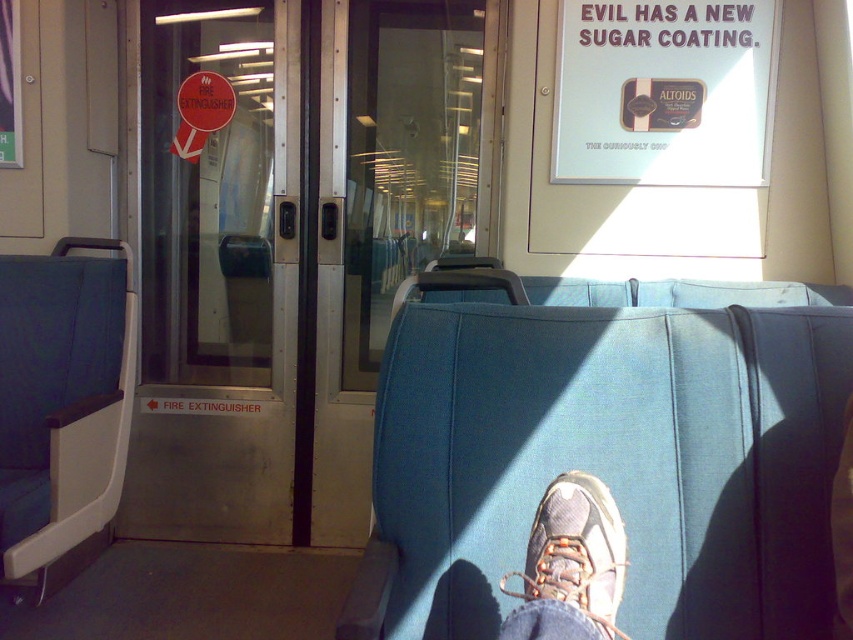
Consider the image. You are a passenger on the train and want to put your feet up on the blue fabric seat at center. However, there is a camouflage fabric sneaker at lower center in the way. Can you move the sneaker to access the seat?

The camouflage fabric sneaker at lower center is behind the blue fabric seat at center, so you cannot directly access it to move it. You would need to ask the owner of the sneaker to move it.

You are standing in the train car and want to sit down. The blue fabric seat at center and the camouflage fabric sneaker at lower center are both in your view. Which object is located to the right side of the other?

The blue fabric seat at center is to the right of camouflage fabric sneaker at lower center.

You are a passenger in the train car and need to know if you can place your backpack between the blue fabric seat at center and the camouflage fabric sneaker at lower center. Can you fit your backpack there?

The blue fabric seat at center is wider than the camouflage fabric sneaker at lower center, so there is space between them. However, the exact width isn not provided, so it depends on your backpack size.